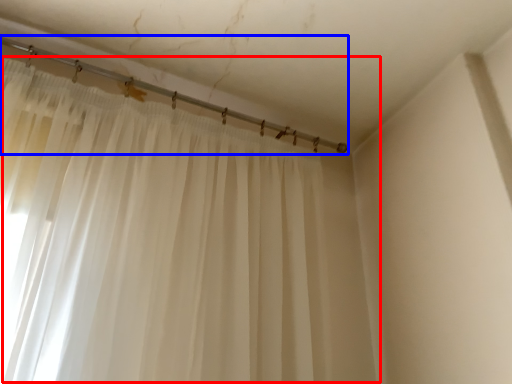
Question: Which of the following is the farthest to the observer, curtain (highlighted by a red box) or beam (highlighted by a blue box)?

Choices:
 (A) curtain
 (B) beam

Answer: (B)